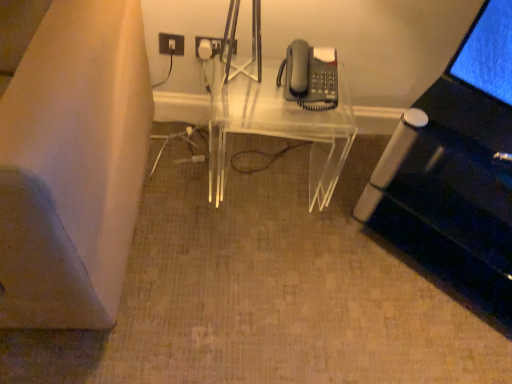
Question: In terms of width, does white plastic electrical outlet at upper center look wider or thinner when compared to matte gray phone at upper right?

Choices:
 (A) thin
 (B) wide

Answer: (A)

Question: From the image's perspective, relative to matte gray phone at upper right, is white plastic electrical outlet at upper center above or below?

Choices:
 (A) below
 (B) above

Answer: (B)

Question: Which is farther from the transparent acrylic table at center?

Choices:
 (A) white plastic electrical outlet at upper center
 (B) matte gray phone at upper right

Answer: (A)

Question: Estimate the real-world distances between objects in this image. Which object is closer to the transparent acrylic table at center?

Choices:
 (A) matte gray phone at upper right
 (B) white plastic electrical outlet at upper center

Answer: (A)